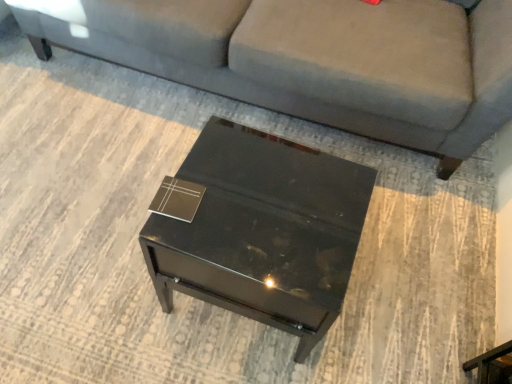
Locate an element on the screen. free space in front of matte black book at center is located at coordinates (178, 234).